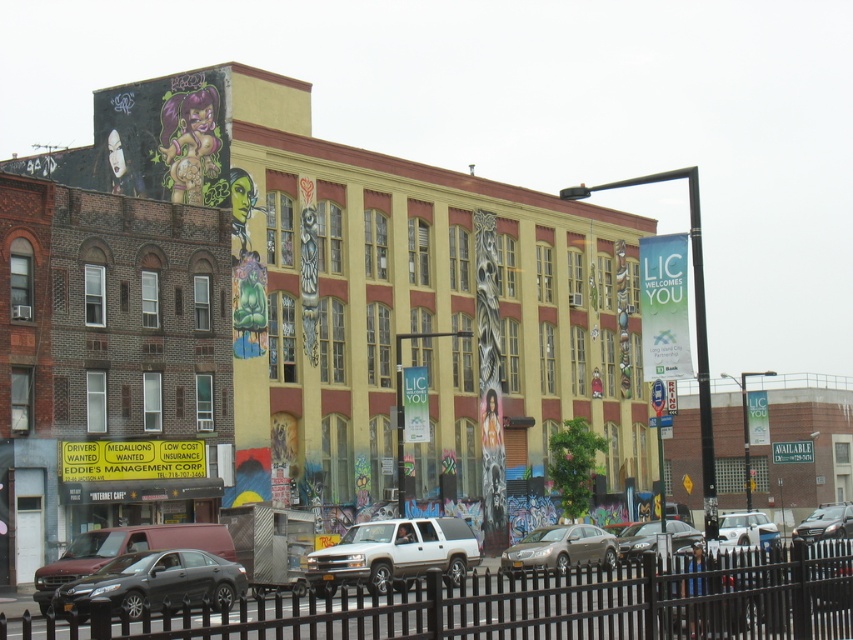
Looking at this image, does gold metallic sedan at center appear on the left side of metallic silver sedan at center?

Correct, you'll find gold metallic sedan at center to the left of metallic silver sedan at center.

Does gold metallic sedan at center appear on the right side of metallic silver sedan at center?

In fact, gold metallic sedan at center is to the left of metallic silver sedan at center.

This screenshot has height=640, width=853. In order to click on gold metallic sedan at center in this screenshot , I will do `click(561, 548)`.

Does black metal fence at lower center have a lesser height compared to gold metallic sedan at center?

Incorrect, black metal fence at lower center's height does not fall short of gold metallic sedan at center's.

This screenshot has width=853, height=640. Identify the location of black metal fence at lower center. (543, 604).

Where is `black metal fence at lower center`? This screenshot has width=853, height=640. black metal fence at lower center is located at coordinates (543, 604).

Who is more forward, (416, 522) or (815, 509)?

Positioned in front is point (416, 522).

Does silver metallic suv at center have a lesser width compared to silver metallic sedan at center?

In fact, silver metallic suv at center might be wider than silver metallic sedan at center.

Who is more forward, (422, 554) or (820, 525)?

Point (422, 554) is more forward.

Locate an element on the screen. Image resolution: width=853 pixels, height=640 pixels. silver metallic suv at center is located at coordinates (393, 554).